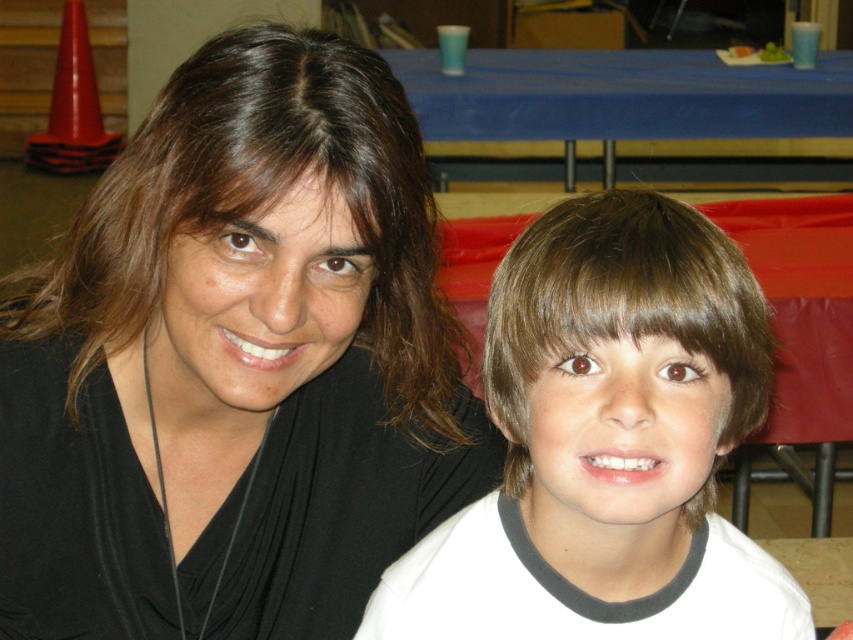
You are standing in front of the image and want to locate the point at coordinates [236,362]. Based on the scene description, where exactly would this point be located?

The point at coordinates [236,362] is on the black matte hair at upper left.

You are a photographer adjusting the lighting for a portrait. The black matte hair at upper left and brown hair at center are in your frame. You need to ensure both are evenly lit. Given their distance apart, do you think you can adjust the lighting to cover both without moving the lights?

The black matte hair at upper left is 17.05 centimeters from brown hair at center. Since the distance is manageable, you can adjust the lighting to cover both without moving the lights.

You are taking a photo of two people sitting at a table with a blue tablecloth. You notice two points marked in the image. The first point is at coordinates point (94,358) and the second is at point (370,600). Which point is closer to the camera?

Point (94,358) is closer to the camera than point (370,600).